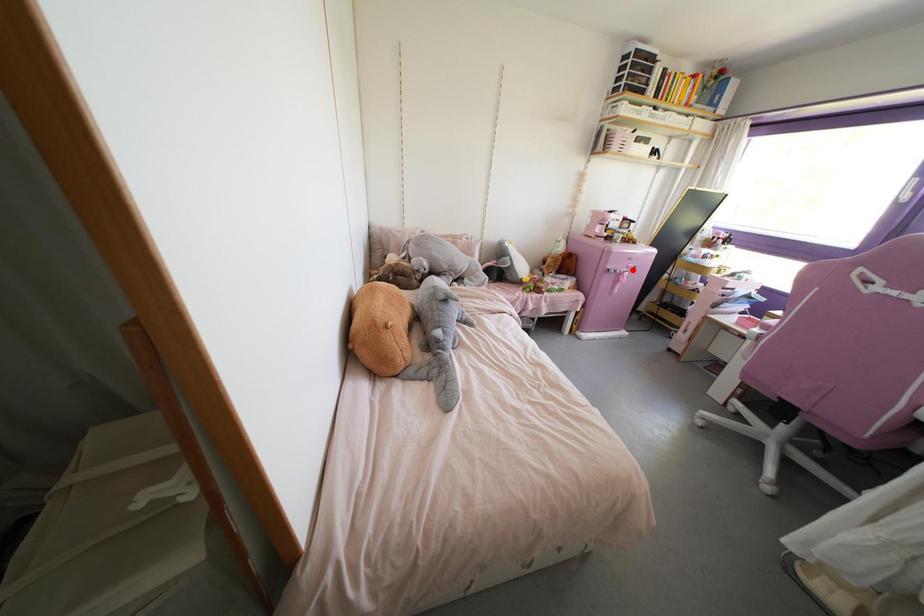
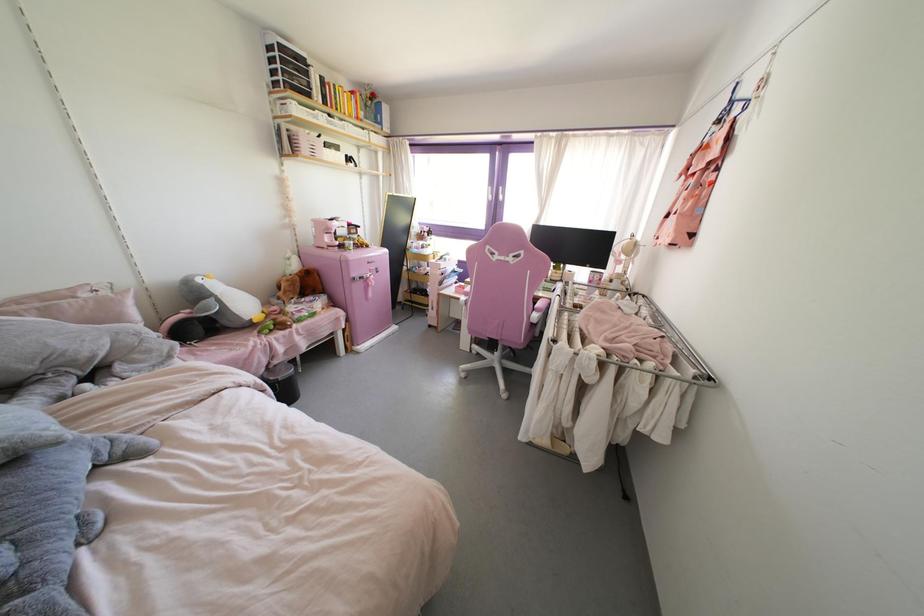
In the second image, find the point that corresponds to the highlighted location in the first image.

(377, 272)